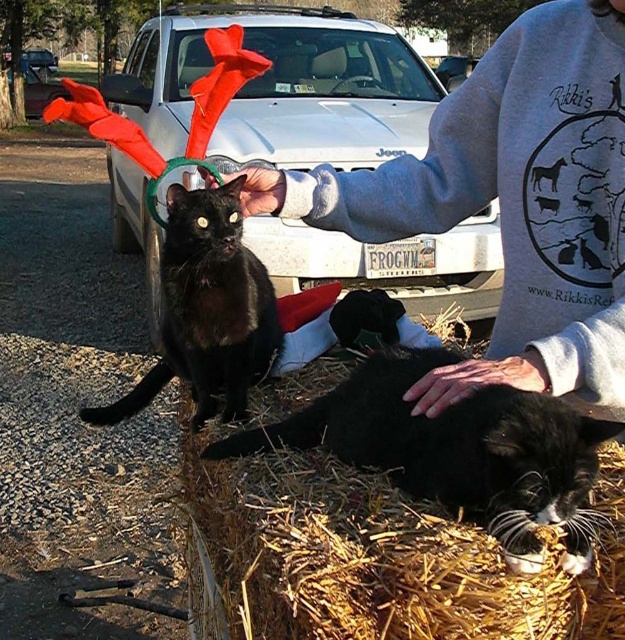
Does black fur at lower right have a lesser height compared to black matte fur cat at left?

Yes.

Is point (526, 435) closer to camera compared to point (118, 401)?

Yes, point (526, 435) is closer to viewer.

Image resolution: width=625 pixels, height=640 pixels. What are the coordinates of `black fur at lower right` in the screenshot? It's located at (456, 451).

Can you confirm if gray fleece sweatshirt at upper center is smaller than black matte fur cat at left?

Actually, gray fleece sweatshirt at upper center might be larger than black matte fur cat at left.

Is gray fleece sweatshirt at upper center thinner than black matte fur cat at left?

In fact, gray fleece sweatshirt at upper center might be wider than black matte fur cat at left.

Between point (618, 358) and point (198, 220), which one is positioned behind?

Positioned behind is point (198, 220).

Find the location of a particular element. gray fleece sweatshirt at upper center is located at coordinates (511, 202).

Between gray fleece sweatshirt at upper center and black fur at lower right, which one appears on the left side from the viewer's perspective?

From the viewer's perspective, black fur at lower right appears more on the left side.

Does gray fleece sweatshirt at upper center come behind black fur at lower right?

Yes, it is behind black fur at lower right.

At what (x,y) coordinates should I click in order to perform the action: click on gray fleece sweatshirt at upper center. Please return your answer as a coordinate pair (x, y). Looking at the image, I should click on (511, 202).